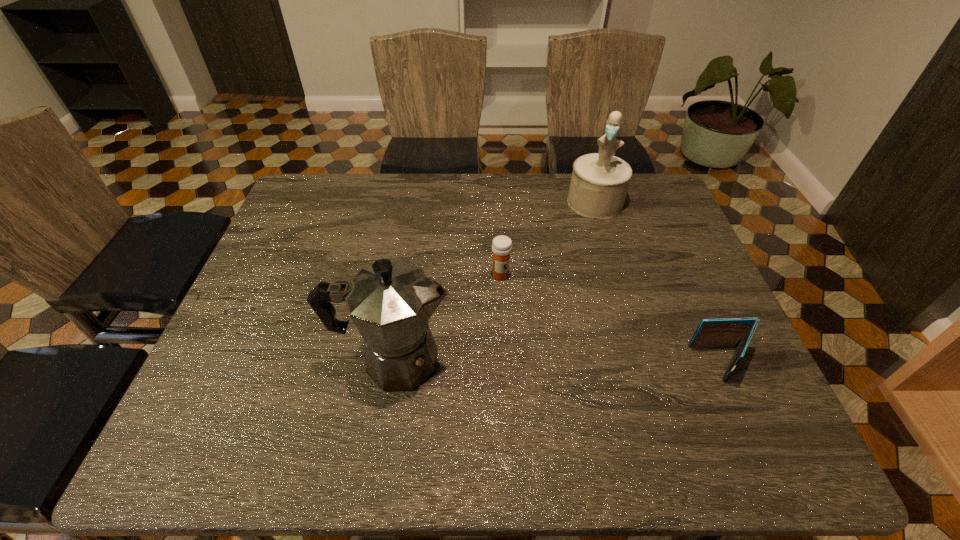
The height and width of the screenshot is (540, 960). Find the location of `the leftmost object`. the leftmost object is located at coordinates (390, 302).

Image resolution: width=960 pixels, height=540 pixels. I want to click on wallet, so click(731, 332).

Identify the location of the rightmost object. (731, 332).

Identify the location of medicine. (501, 245).

In order to click on the third nearest object in this screenshot , I will do `click(501, 245)`.

The width and height of the screenshot is (960, 540). Find the location of `the farthest object`. the farthest object is located at coordinates [x=599, y=183].

Find the location of a particular element. The image size is (960, 540). figurine is located at coordinates (599, 183).

The width and height of the screenshot is (960, 540). What are the coordinates of `free location located on the pouring side of the coffeepot` in the screenshot? It's located at (525, 361).

Where is `blank space located 0.350m on the exterior surface of the wallet`? blank space located 0.350m on the exterior surface of the wallet is located at coordinates (539, 363).

Where is `vacant position located on the exterior surface of the wallet`? The height and width of the screenshot is (540, 960). vacant position located on the exterior surface of the wallet is located at coordinates (565, 363).